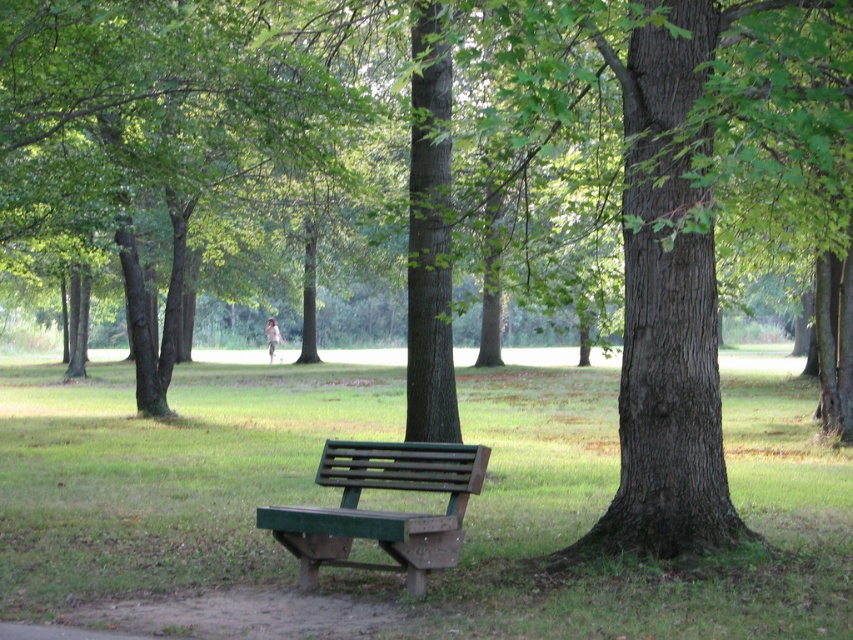
You are a gardener who wants to plant a new flower bed between the green grass at center and the green leafy tree at center. Which area has more space available for planting?

The green grass at center has a larger width than the green leafy tree at center, so there is more space available for planting in the green grass at center area.

You are standing in the park and want to sit on the green wood bench at lower center. Which object is closer to you as you approach the bench? Is it the green grass at center or the bench itself?

The green grass at center is closer to the viewer than the green wood bench at lower center, so the grass is closer as you approach the bench.

You are planning to place a small garden ornament on the green grass at center and under the green leafy tree at center. Which area would be more suitable for the ornament based on their sizes?

The green grass at center has a smaller size compared to the green leafy tree at center, so the ornament should be placed on the green grass at center as it is more appropriate for smaller items.